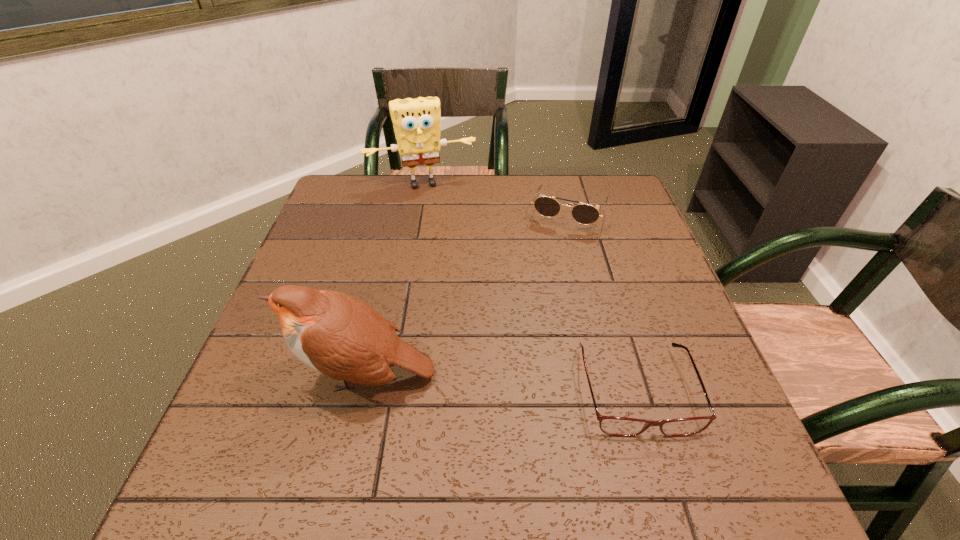
Find the location of a particular element. object that is at the far left corner is located at coordinates (416, 122).

Locate an element on the screen. The width and height of the screenshot is (960, 540). object present at the near left corner is located at coordinates coord(339,335).

Find the location of `object at the far right corner`. object at the far right corner is located at coordinates (585, 214).

Find the location of a particular element. The width and height of the screenshot is (960, 540). object that is at the near right corner is located at coordinates (616, 426).

Find the location of a particular element. This screenshot has width=960, height=540. free location at the far edge is located at coordinates (419, 187).

In the image, there is a desktop. Identify the location of free region at the near edge. The image size is (960, 540). (451, 427).

This screenshot has width=960, height=540. In the image, there is a desktop. What are the coordinates of `free space at the left edge` in the screenshot? It's located at [x=345, y=225].

In the image, there is a desktop. At what (x,y) coordinates should I click in order to perform the action: click on vacant area at the right edge. Please return your answer as a coordinate pair (x, y). The image size is (960, 540). Looking at the image, I should click on (618, 296).

Where is `vacant region at the far left corner`? The image size is (960, 540). vacant region at the far left corner is located at coordinates tap(349, 186).

The image size is (960, 540). Identify the location of empty space between the sponge and the shortest object. (529, 287).